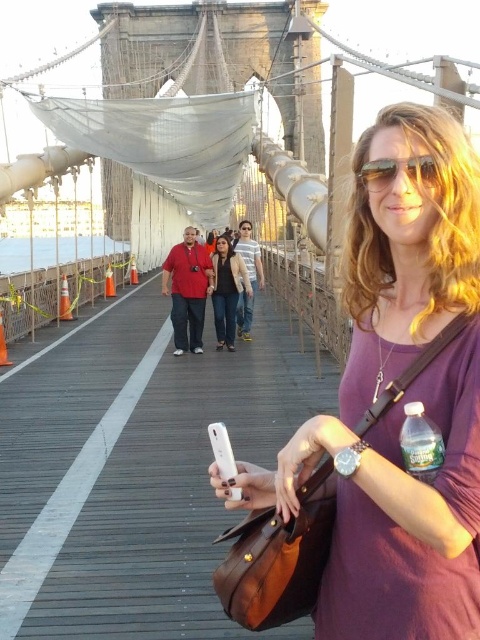
In the scene shown: Is purple leather shirt at center above clear plastic bottle at lower right?

Yes.

Which is in front, point (468, 180) or point (424, 472)?

Point (424, 472) is more forward.

You are a GUI agent. You are given a task and a screenshot of the screen. Output one action in this format:
    pyautogui.click(x=<x>, y=<y>)
    Task: Click on the purple leather shirt at center
    
    Given the screenshot: What is the action you would take?
    pyautogui.click(x=398, y=401)

Is point (217, 292) positioned before point (388, 166)?

No.

This screenshot has height=640, width=480. What do you see at coordinates (227, 291) in the screenshot?
I see `matte black jacket at center` at bounding box center [227, 291].

Is point (232, 317) behind point (359, 176)?

Yes, it is behind point (359, 176).

Find the location of a particular element. matte black jacket at center is located at coordinates (227, 291).

Can you confirm if matte black jacket at center is positioned to the left of clear plastic bottle at lower right?

Correct, you'll find matte black jacket at center to the left of clear plastic bottle at lower right.

Between point (216, 280) and point (428, 461), which one is positioned behind?

The point (216, 280) is more distant.

Where is `matte black jacket at center`? matte black jacket at center is located at coordinates (227, 291).